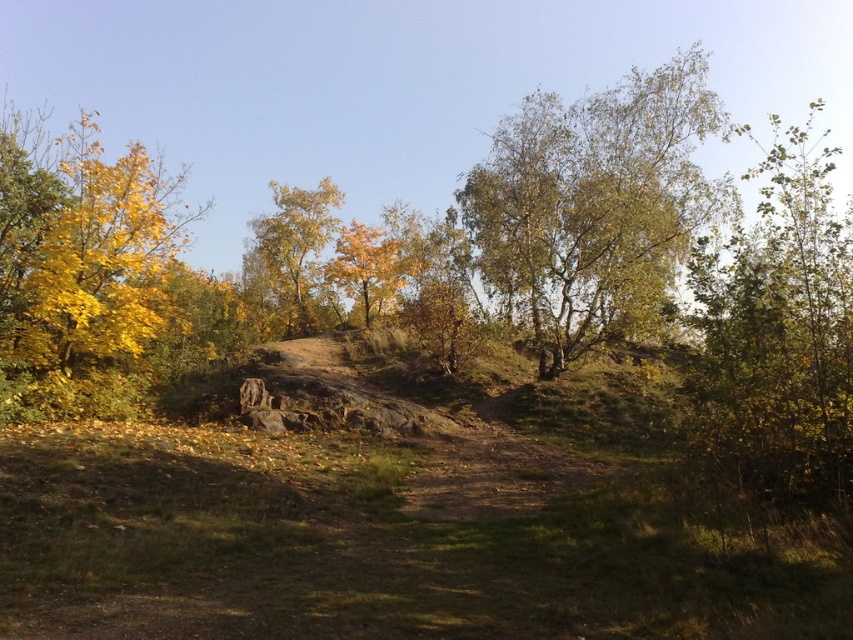
You are a hiker walking along the dirt path in the autumn landscape. You notice two trees at the center of the scene. Which tree is closer to you, the golden textured tree at center or the yellow matte tree at center?

The golden textured tree at center is closer to you because it is positioned over the yellow matte tree at center, indicating it is in front.

Looking at this image, you are standing at the point marked by the coordinates point at (779, 333). Looking around, you see a green leafy tree at right. Which direction should you walk to reach the green leafy tree at right?

Since you are standing at point at (779, 333) and the green leafy tree at right is located to your right side, you should walk towards your right to reach the green leafy tree at right.

You are a hiker trying to decide which tree to rest under. You have two options in the scene described. Which tree has a wider trunk, the golden textured tree at center or the yellow matte tree at center?

The golden textured tree at center is wider than the yellow matte tree at center, so it would have a wider trunk.